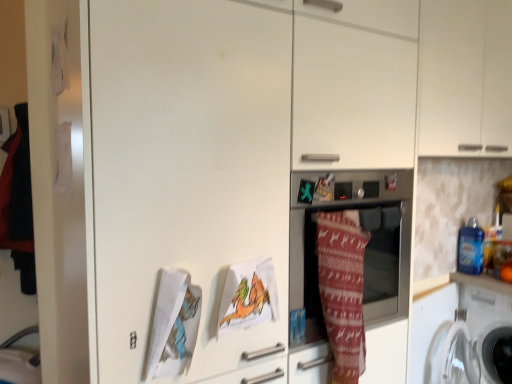
Identify the location of metallic oven at center. click(366, 246).

Measure the distance between white plastic washing machine at lower right, the first washing machine positioned from the left, and camera.

white plastic washing machine at lower right, the first washing machine positioned from the left, and camera are 1.89 meters apart from each other.

How much space does white plastic washing machine at lower right, positioned as the 1th washing machine in right-to-left order, occupy horizontally?

white plastic washing machine at lower right, positioned as the 1th washing machine in right-to-left order, is 24.96 inches in width.

I want to click on knitted woolen blanket at center, so click(x=342, y=291).

Locate an element on the screen. Image resolution: width=512 pixels, height=384 pixels. metallic oven at center is located at coordinates (366, 246).

Is white plastic washing machine at lower right, the first washing machine positioned from the left, thinner than white plastic washing machine at lower right, positioned as the 1th washing machine in right-to-left order?

Yes, white plastic washing machine at lower right, the first washing machine positioned from the left, is thinner than white plastic washing machine at lower right, positioned as the 1th washing machine in right-to-left order.

Would you say white plastic washing machine at lower right, the first washing machine positioned from the left, is outside white plastic washing machine at lower right, the second washing machine when ordered from left to right?

Yes, white plastic washing machine at lower right, the first washing machine positioned from the left, is located beyond the bounds of white plastic washing machine at lower right, the second washing machine when ordered from left to right.

From a real-world perspective, between white plastic washing machine at lower right, the first washing machine positioned from the left, and white plastic washing machine at lower right, positioned as the 1th washing machine in right-to-left order, who is vertically higher?

white plastic washing machine at lower right, the first washing machine positioned from the left, from a real-world perspective.

What's the angular difference between knitted woolen blanket at center and white plastic washing machine at lower right, which is counted as the second washing machine, starting from the right,'s facing directions?

There is a 9.82-degree angle between the facing directions of knitted woolen blanket at center and white plastic washing machine at lower right, which is counted as the second washing machine, starting from the right.

Is knitted woolen blanket at center positioned behind white plastic washing machine at lower right, which is counted as the second washing machine, starting from the right?

That is False.

Is knitted woolen blanket at center positioned with its back to white plastic washing machine at lower right, which is counted as the second washing machine, starting from the right?

knitted woolen blanket at center does not have its back to white plastic washing machine at lower right, which is counted as the second washing machine, starting from the right.

From the picture: Can you confirm if knitted woolen blanket at center is thinner than white plastic washing machine at lower right, the second washing machine when ordered from left to right?

Yes, knitted woolen blanket at center is thinner than white plastic washing machine at lower right, the second washing machine when ordered from left to right.

Which object is closer to the camera, knitted woolen blanket at center or white plastic washing machine at lower right, the second washing machine when ordered from left to right?

knitted woolen blanket at center is in front.

Would you say knitted woolen blanket at center is outside white plastic washing machine at lower right, positioned as the 1th washing machine in right-to-left order?

Yes, knitted woolen blanket at center is outside of white plastic washing machine at lower right, positioned as the 1th washing machine in right-to-left order.

You are a GUI agent. You are given a task and a screenshot of the screen. Output one action in this format:
    pyautogui.click(x=<x>, y=<y>)
    Task: Click on the cabinetry lying behind the metallic oven at center
    The image size is (512, 384).
    Given the screenshot: What is the action you would take?
    pyautogui.click(x=465, y=78)

Considering the relative positions of white matte cabinet at upper right and metallic oven at center in the image provided, is white matte cabinet at upper right to the left of metallic oven at center from the viewer's perspective?

No, white matte cabinet at upper right is not to the left of metallic oven at center.

Does white matte cabinet at upper right have a smaller size compared to metallic oven at center?

No.

Does point (351, 247) come behind point (309, 337)?

No, (351, 247) is closer to viewer.

Considering the sizes of objects knitted woolen blanket at center and metallic oven at center in the image provided, who is bigger, knitted woolen blanket at center or metallic oven at center?

Bigger between the two is metallic oven at center.

Which is more to the right, knitted woolen blanket at center or metallic oven at center?

From the viewer's perspective, knitted woolen blanket at center appears more on the right side.

This screenshot has height=384, width=512. In order to click on home appliance above the knitted woolen blanket at center (from a real-world perspective) in this screenshot , I will do `click(366, 246)`.

Between knitted woolen blanket at center and white matte cabinet at upper right, which one has less height?

Standing shorter between the two is knitted woolen blanket at center.

From the picture: Would you consider knitted woolen blanket at center to be distant from white matte cabinet at upper right?

No.

You are a GUI agent. You are given a task and a screenshot of the screen. Output one action in this format:
    pyautogui.click(x=<x>, y=<y>)
    Task: Click on the cabinetry located above the knitted woolen blanket at center (from the image's perspective)
    
    Given the screenshot: What is the action you would take?
    pyautogui.click(x=465, y=78)

Considering the relative sizes of knitted woolen blanket at center and white matte cabinet at upper right in the image provided, is knitted woolen blanket at center wider than white matte cabinet at upper right?

No, knitted woolen blanket at center is not wider than white matte cabinet at upper right.

Does white matte cabinet at upper right have a lesser width compared to knitted woolen blanket at center?

Incorrect, the width of white matte cabinet at upper right is not less than that of knitted woolen blanket at center.

From the image's perspective, which one is positioned higher, white matte cabinet at upper right or knitted woolen blanket at center?

white matte cabinet at upper right appears higher in the image.

Consider the image. Is white matte cabinet at upper right to the left of knitted woolen blanket at center from the viewer's perspective?

No.

Where is `cabinetry that is behind the knitted woolen blanket at center`? cabinetry that is behind the knitted woolen blanket at center is located at coordinates (465, 78).

The width and height of the screenshot is (512, 384). Find the location of `washing machine above the white plastic washing machine at lower right, positioned as the 1th washing machine in right-to-left order (from the image's perspective)`. washing machine above the white plastic washing machine at lower right, positioned as the 1th washing machine in right-to-left order (from the image's perspective) is located at coordinates (460, 331).

Find the location of `blanket that is above the white plastic washing machine at lower right, which is counted as the second washing machine, starting from the right (from a real-world perspective)`. blanket that is above the white plastic washing machine at lower right, which is counted as the second washing machine, starting from the right (from a real-world perspective) is located at coordinates (342, 291).

When comparing their distances from white matte cabinet at upper right, does white plastic washing machine at lower right, the first washing machine positioned from the left, or knitted woolen blanket at center seem closer?

Among the two, knitted woolen blanket at center is located nearer to white matte cabinet at upper right.

Based on the photo, which object lies nearer to the anchor point white plastic washing machine at lower right, the second washing machine when ordered from left to right, white matte cabinet at upper right or knitted woolen blanket at center?

→ Based on the image, white matte cabinet at upper right appears to be nearer to white plastic washing machine at lower right, the second washing machine when ordered from left to right.

Looking at the image, which one is located closer to white plastic washing machine at lower right, the second washing machine when ordered from left to right, white matte cabinet at upper right or white plastic washing machine at lower right, which is counted as the second washing machine, starting from the right?

white plastic washing machine at lower right, which is counted as the second washing machine, starting from the right, lies closer to white plastic washing machine at lower right, the second washing machine when ordered from left to right, than the other object.

Which object lies nearer to the anchor point white plastic washing machine at lower right, which is counted as the second washing machine, starting from the right, metallic oven at center or knitted woolen blanket at center?

The object closer to white plastic washing machine at lower right, which is counted as the second washing machine, starting from the right, is metallic oven at center.

Considering their positions, is metallic oven at center positioned closer to white matte cabinet at upper right than white plastic washing machine at lower right, the first washing machine positioned from the left?

Among the two, metallic oven at center is located nearer to white matte cabinet at upper right.

Looking at the image, which one is located further to knitted woolen blanket at center, white matte cabinet at upper right or white plastic washing machine at lower right, which is counted as the second washing machine, starting from the right?

white plastic washing machine at lower right, which is counted as the second washing machine, starting from the right.

Based on their spatial positions, is knitted woolen blanket at center or white plastic washing machine at lower right, the first washing machine positioned from the left, further from white plastic washing machine at lower right, the second washing machine when ordered from left to right?

knitted woolen blanket at center is further to white plastic washing machine at lower right, the second washing machine when ordered from left to right.

Estimate the real-world distances between objects in this image. Which object is closer to white matte cabinet at upper right, metallic oven at center or white plastic washing machine at lower right, positioned as the 1th washing machine in right-to-left order?

Among the two, metallic oven at center is located nearer to white matte cabinet at upper right.

Locate an element on the screen. blanket between white matte cabinet at upper right and white plastic washing machine at lower right, positioned as the 1th washing machine in right-to-left order, from top to bottom is located at coordinates (342, 291).

Where is `washing machine that lies between white matte cabinet at upper right and white plastic washing machine at lower right, the second washing machine when ordered from left to right, from top to bottom`? This screenshot has height=384, width=512. washing machine that lies between white matte cabinet at upper right and white plastic washing machine at lower right, the second washing machine when ordered from left to right, from top to bottom is located at coordinates (460, 331).

Find the location of a particular element. Image resolution: width=512 pixels, height=384 pixels. washing machine between knitted woolen blanket at center and white plastic washing machine at lower right, the second washing machine when ordered from left to right, from left to right is located at coordinates (460, 331).

Where is `blanket located between metallic oven at center and white plastic washing machine at lower right, the first washing machine positioned from the left, in the left-right direction`? This screenshot has width=512, height=384. blanket located between metallic oven at center and white plastic washing machine at lower right, the first washing machine positioned from the left, in the left-right direction is located at coordinates (342, 291).